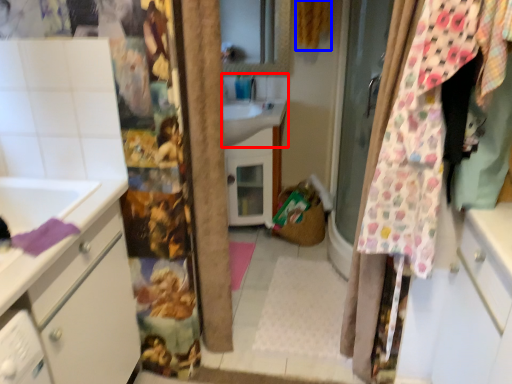
Question: Which point is further to the camera, sink (highlighted by a red box) or curtain (highlighted by a blue box)?

Choices:
 (A) sink
 (B) curtain

Answer: (A)